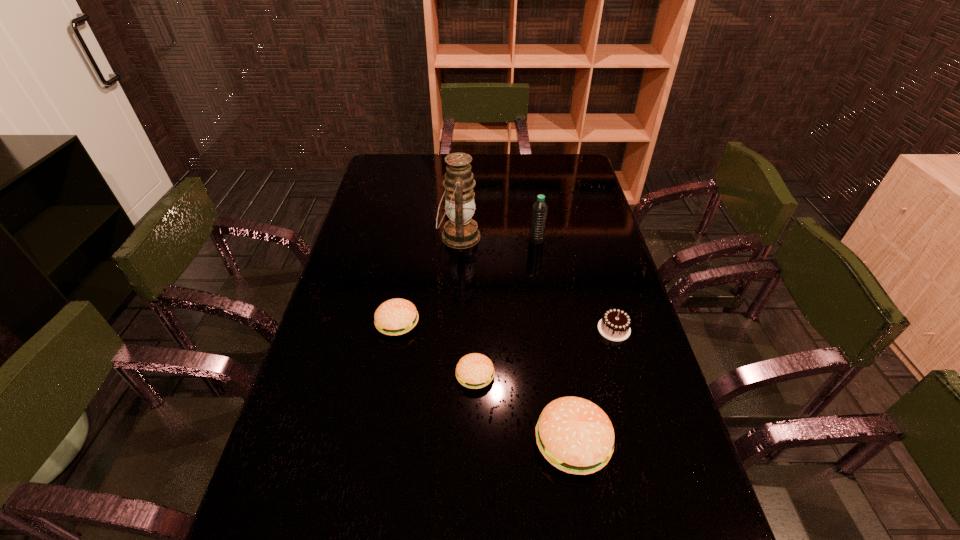
Identify the location of free space located 0.050m on the front of the shortest object. The height and width of the screenshot is (540, 960). point(475,410).

At what (x,y) coordinates should I click in order to perform the action: click on free spot located on the left of the fourth shortest object. Please return your answer as a coordinate pair (x, y). Looking at the image, I should click on (387, 442).

This screenshot has width=960, height=540. Find the location of `vacant space located 0.240m on the left of the rightmost object`. vacant space located 0.240m on the left of the rightmost object is located at coordinates (514, 329).

The width and height of the screenshot is (960, 540). I want to click on vacant region located 0.230m on the left of the lantern, so click(x=372, y=237).

The image size is (960, 540). I want to click on free point located on the front of the water bottle, so click(550, 329).

Locate an element on the screen. The height and width of the screenshot is (540, 960). object that is at the left edge is located at coordinates (397, 316).

At what (x,y) coordinates should I click in order to perform the action: click on patty that is at the right edge. Please return your answer as a coordinate pair (x, y). The width and height of the screenshot is (960, 540). Looking at the image, I should click on (576, 436).

The height and width of the screenshot is (540, 960). Find the location of `chocolate cake at the right edge`. chocolate cake at the right edge is located at coordinates (615, 324).

The image size is (960, 540). In the image, there is a desktop. What are the coordinates of `free space at the far edge` in the screenshot? It's located at (540, 174).

The width and height of the screenshot is (960, 540). I want to click on vacant region at the near edge of the desktop, so click(399, 526).